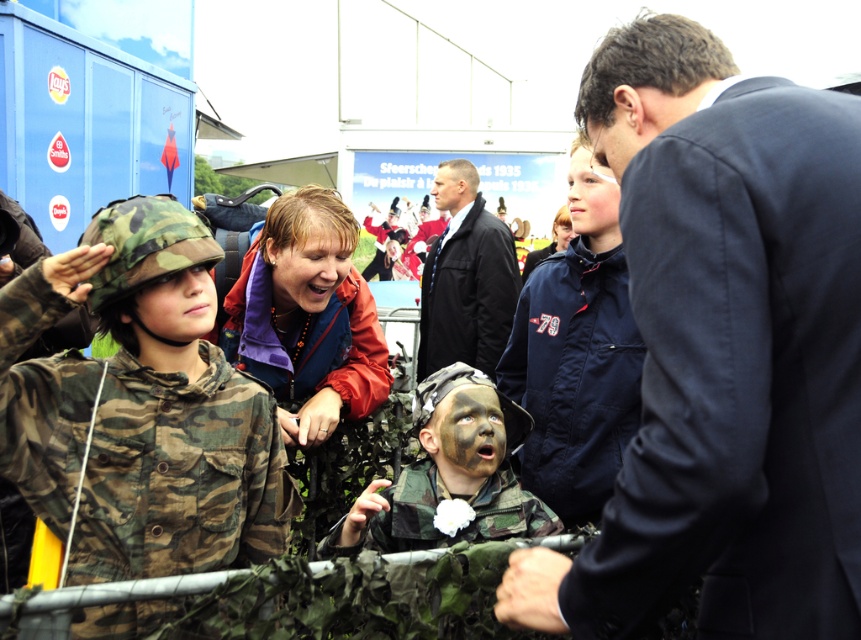
Is camo fabric uniform at left in front of smooth skin face at center?

No.

Where is `camo fabric uniform at left`? This screenshot has width=861, height=640. camo fabric uniform at left is located at coordinates (137, 413).

Between point (834, 225) and point (575, 445), which one is positioned in front?

Point (834, 225) is more forward.

Is point (739, 246) behind point (568, 308)?

No, it is not.

This screenshot has width=861, height=640. I want to click on dark blue suit at center, so click(725, 355).

Is camo fabric uniform at left shorter than dark blue jacket at center?

Indeed, camo fabric uniform at left has a lesser height compared to dark blue jacket at center.

Is camo fabric uniform at left above dark blue jacket at center?

No, camo fabric uniform at left is not above dark blue jacket at center.

The width and height of the screenshot is (861, 640). What do you see at coordinates (137, 413) in the screenshot? I see `camo fabric uniform at left` at bounding box center [137, 413].

I want to click on camo fabric uniform at left, so click(x=137, y=413).